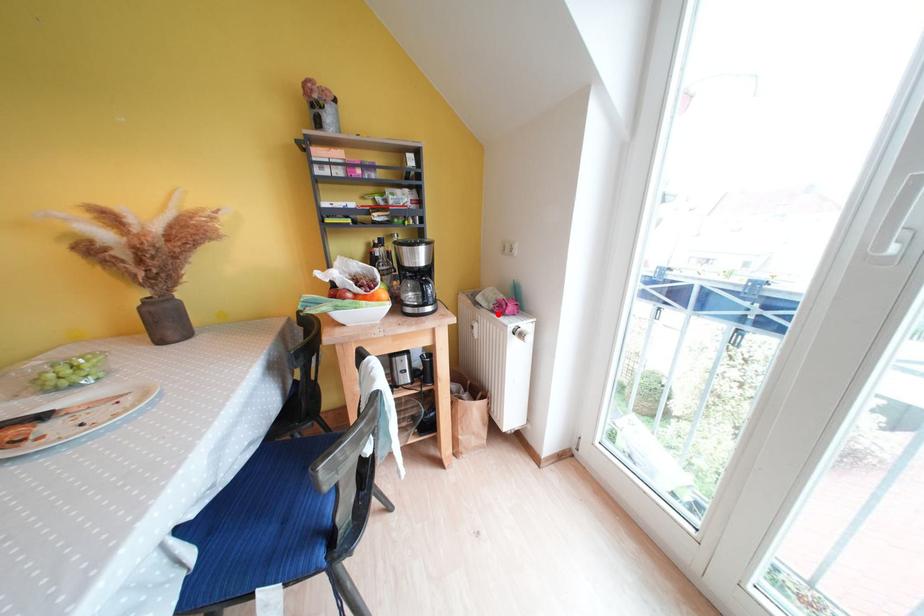
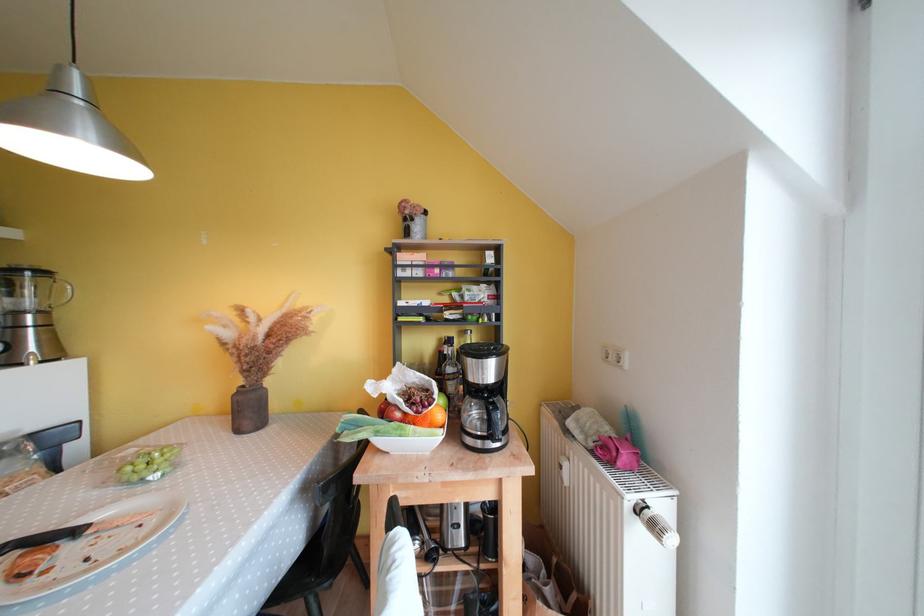
Where in the second image is the point corresponding to the highlighted location from the first image?

(599, 456)